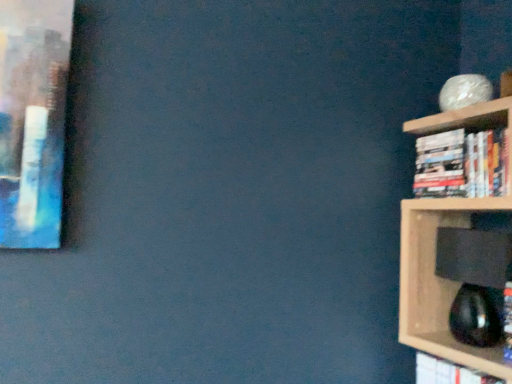
What are the coordinates of `hardcover book at right, which appears as the second book when viewed from the top` in the screenshot? It's located at point(448,372).

What do you see at coordinates (448, 372) in the screenshot?
I see `hardcover book at right, which appears as the second book when viewed from the top` at bounding box center [448, 372].

The height and width of the screenshot is (384, 512). What are the coordinates of `hardcover books at right, the 1th book when ordered from top to bottom` in the screenshot? It's located at (461, 164).

The width and height of the screenshot is (512, 384). Describe the element at coordinates (461, 164) in the screenshot. I see `hardcover books at right, the second book ordered from the bottom` at that location.

Where is `hardcover book at right, which appears as the second book when viewed from the top`? The height and width of the screenshot is (384, 512). hardcover book at right, which appears as the second book when viewed from the top is located at coordinates (448, 372).

Can you confirm if hardcover books at right, the 1th book when ordered from top to bottom, is positioned to the left of hardcover book at right, which is counted as the 1th book, starting from the bottom?

Incorrect, hardcover books at right, the 1th book when ordered from top to bottom, is not on the left side of hardcover book at right, which is counted as the 1th book, starting from the bottom.

Which is behind, hardcover books at right, the 1th book when ordered from top to bottom, or hardcover book at right, which is counted as the 1th book, starting from the bottom?

hardcover books at right, the 1th book when ordered from top to bottom, is more distant.

Which point is more distant from viewer, (x=473, y=140) or (x=419, y=361)?

The point (x=419, y=361) is farther from the camera.

From the image's perspective, is hardcover books at right, the 1th book when ordered from top to bottom, beneath hardcover book at right, which is counted as the 1th book, starting from the bottom?

Incorrect, from the image's perspective, hardcover books at right, the 1th book when ordered from top to bottom, is higher than hardcover book at right, which is counted as the 1th book, starting from the bottom.

From the picture: From a real-world perspective, relative to hardcover book at right, which appears as the second book when viewed from the top, is hardcover books at right, the 1th book when ordered from top to bottom, vertically above or below?

In terms of real-world spatial position, hardcover books at right, the 1th book when ordered from top to bottom, is above hardcover book at right, which appears as the second book when viewed from the top.

Can you confirm if hardcover books at right, the second book ordered from the bottom, is thinner than hardcover book at right, which is counted as the 1th book, starting from the bottom?

In fact, hardcover books at right, the second book ordered from the bottom, might be wider than hardcover book at right, which is counted as the 1th book, starting from the bottom.

Is hardcover books at right, the second book ordered from the bottom, shorter than hardcover book at right, which is counted as the 1th book, starting from the bottom?

No.

Who is smaller, hardcover books at right, the 1th book when ordered from top to bottom, or hardcover book at right, which is counted as the 1th book, starting from the bottom?

hardcover book at right, which is counted as the 1th book, starting from the bottom.

Does hardcover books at right, the second book ordered from the bottom, contain hardcover book at right, which is counted as the 1th book, starting from the bottom?

Actually, hardcover book at right, which is counted as the 1th book, starting from the bottom, is outside hardcover books at right, the second book ordered from the bottom.

Is hardcover books at right, the second book ordered from the bottom, next to hardcover book at right, which is counted as the 1th book, starting from the bottom, and touching it?

No, hardcover books at right, the second book ordered from the bottom, is not with hardcover book at right, which is counted as the 1th book, starting from the bottom.

Is hardcover books at right, the 1th book when ordered from top to bottom, turned away from hardcover book at right, which is counted as the 1th book, starting from the bottom?

No, hardcover book at right, which is counted as the 1th book, starting from the bottom, is not at the back of hardcover books at right, the 1th book when ordered from top to bottom.

You are a GUI agent. You are given a task and a screenshot of the screen. Output one action in this format:
    pyautogui.click(x=<x>, y=<y>)
    Task: Click on the book positioned vertically above the hardcover book at right, which appears as the second book when viewed from the top (from a real-world perspective)
    The width and height of the screenshot is (512, 384).
    Given the screenshot: What is the action you would take?
    pyautogui.click(x=461, y=164)

Is hardcover book at right, which appears as the second book when viewed from the top, at the left side of hardcover books at right, the second book ordered from the bottom?

Correct, you'll find hardcover book at right, which appears as the second book when viewed from the top, to the left of hardcover books at right, the second book ordered from the bottom.

Which is behind, hardcover book at right, which is counted as the 1th book, starting from the bottom, or hardcover books at right, the second book ordered from the bottom?

hardcover books at right, the second book ordered from the bottom, is more distant.

Which is in front, point (437, 368) or point (494, 190)?

The point (494, 190) is more forward.

From the image's perspective, is hardcover book at right, which is counted as the 1th book, starting from the bottom, located beneath hardcover books at right, the second book ordered from the bottom?

Yes, from the image's perspective, hardcover book at right, which is counted as the 1th book, starting from the bottom, is below hardcover books at right, the second book ordered from the bottom.

From a real-world perspective, is hardcover book at right, which is counted as the 1th book, starting from the bottom, on top of hardcover books at right, the second book ordered from the bottom?

Actually, hardcover book at right, which is counted as the 1th book, starting from the bottom, is physically below hardcover books at right, the second book ordered from the bottom, in the real world.

Looking at their sizes, would you say hardcover book at right, which appears as the second book when viewed from the top, is wider or thinner than hardcover books at right, the second book ordered from the bottom?

Clearly, hardcover book at right, which appears as the second book when viewed from the top, has less width compared to hardcover books at right, the second book ordered from the bottom.

Is hardcover book at right, which appears as the second book when viewed from the top, taller than hardcover books at right, the second book ordered from the bottom?

No, hardcover book at right, which appears as the second book when viewed from the top, is not taller than hardcover books at right, the second book ordered from the bottom.

Is hardcover book at right, which appears as the second book when viewed from the top, bigger or smaller than hardcover books at right, the second book ordered from the bottom?

hardcover book at right, which appears as the second book when viewed from the top, is smaller than hardcover books at right, the second book ordered from the bottom.

Is hardcover books at right, the second book ordered from the bottom, inside hardcover book at right, which appears as the second book when viewed from the top?

That's incorrect, hardcover books at right, the second book ordered from the bottom, is not inside hardcover book at right, which appears as the second book when viewed from the top.

Is there a large distance between hardcover book at right, which appears as the second book when viewed from the top, and hardcover books at right, the 1th book when ordered from top to bottom?

That's not correct — hardcover book at right, which appears as the second book when viewed from the top, is a little close to hardcover books at right, the 1th book when ordered from top to bottom.

Is hardcover book at right, which appears as the second book when viewed from the top, oriented away from hardcover books at right, the 1th book when ordered from top to bottom?

No.

What are the coordinates of `book on the left of hardcover books at right, the 1th book when ordered from top to bottom` in the screenshot? It's located at (448, 372).

You are a GUI agent. You are given a task and a screenshot of the screen. Output one action in this format:
    pyautogui.click(x=<x>, y=<y>)
    Task: Click on the book that is above the hardcover book at right, which is counted as the 1th book, starting from the bottom (from a real-world perspective)
    Image resolution: width=512 pixels, height=384 pixels.
    Given the screenshot: What is the action you would take?
    pyautogui.click(x=461, y=164)

Identify the location of book to the right of hardcover book at right, which appears as the second book when viewed from the top. (461, 164).